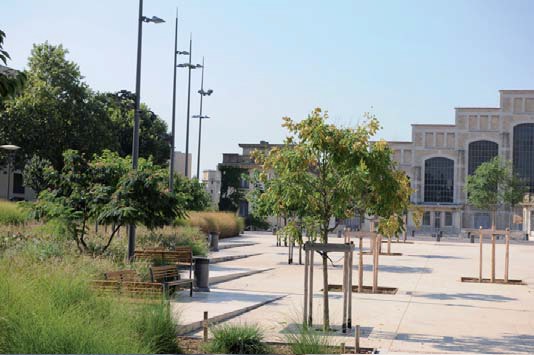
In order to click on windows in this screenshot , I will do `click(435, 178)`, `click(482, 150)`, `click(528, 150)`.